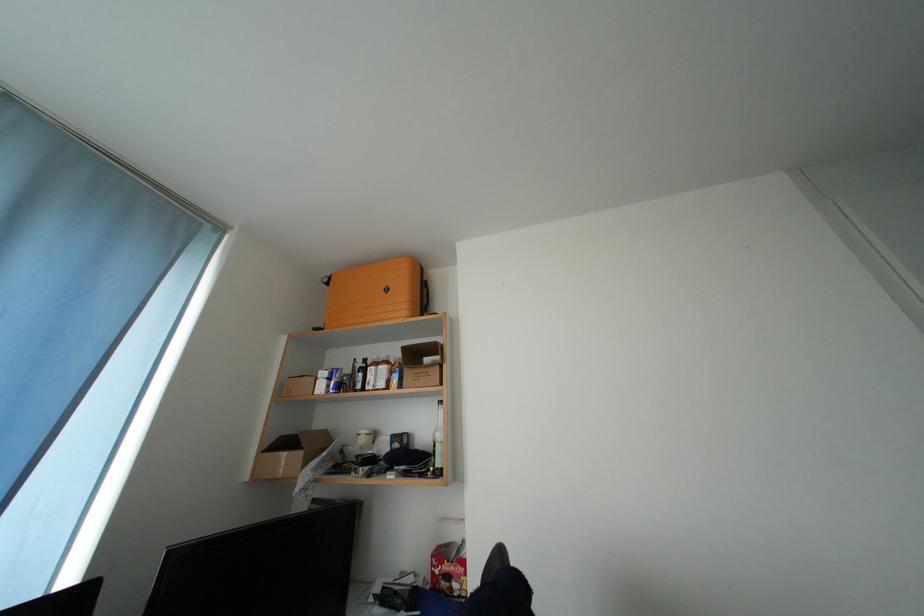
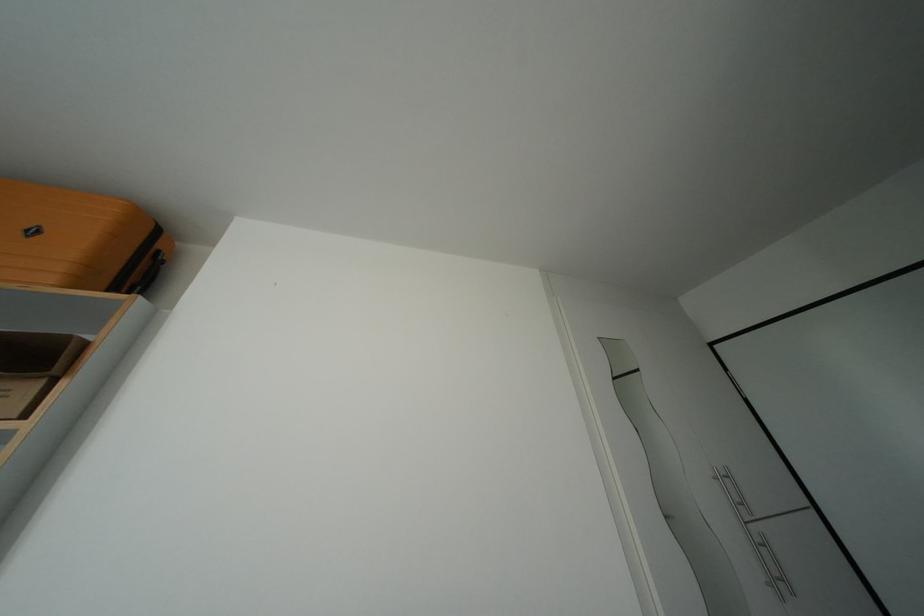
The point at (433, 308) is marked in the first image. Where is the corresponding point in the second image?

(141, 285)